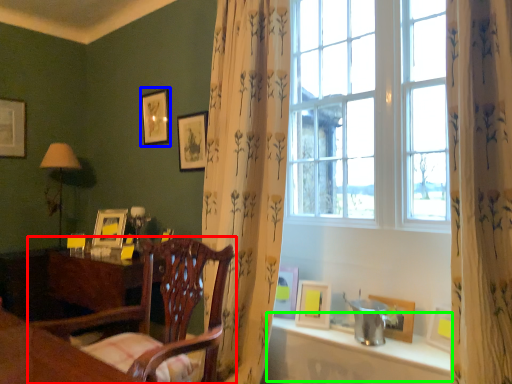
Question: Estimate the real-world distances between objects in this image. Which object is closer to chair (highlighted by a red box), picture frame (highlighted by a blue box) or window sill (highlighted by a green box)?

Choices:
 (A) picture frame
 (B) window sill

Answer: (B)